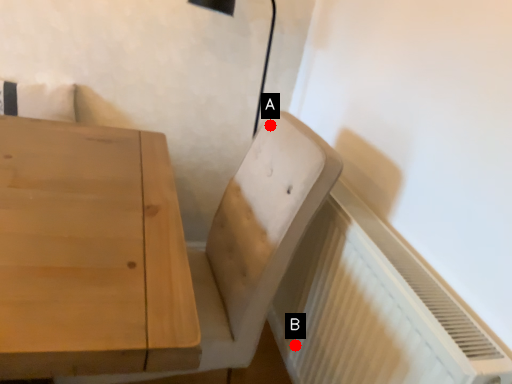
Question: Two points are circled on the image, labeled by A and B beside each circle. Which point appears farthest from the camera in this image?

Choices:
 (A) A is further
 (B) B is further

Answer: (B)